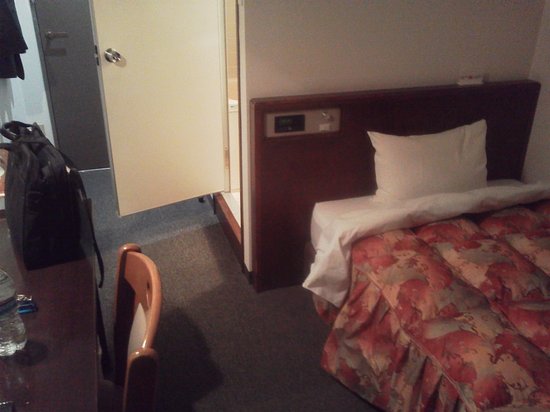
Find the location of a particular element. The image size is (550, 412). door knob is located at coordinates (114, 56).